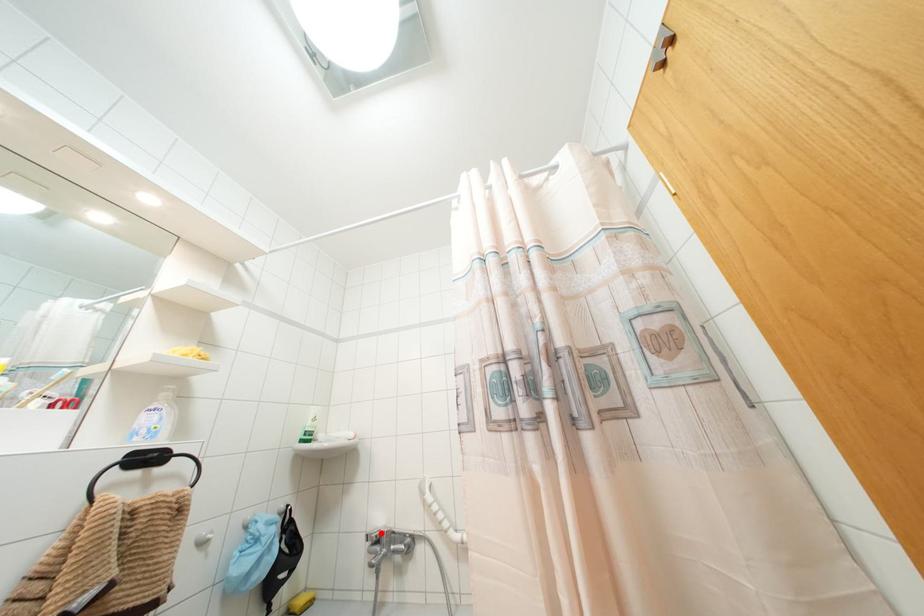
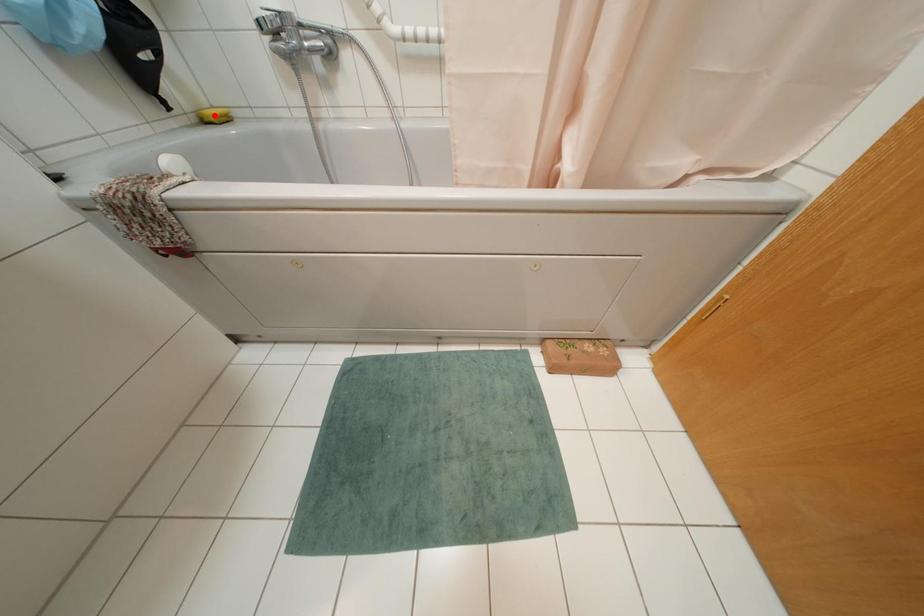
I am providing you with two images of the same scene from different viewpoints. A red point is marked on the first image and another point is marked on the second image. Is the red point in image1 aligned with the point shown in image2?

No